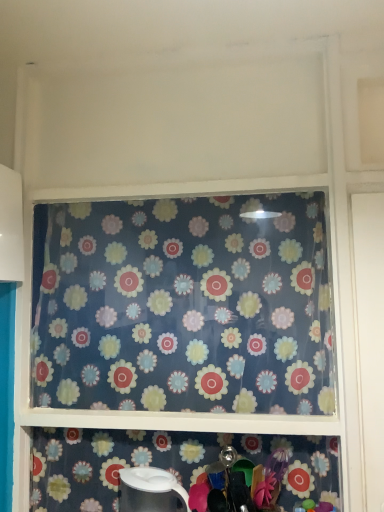
Question: From a real-world perspective, is white glossy kettle at lower center physically above floral-patterned fabric at center?

Choices:
 (A) yes
 (B) no

Answer: (B)

Question: Is white glossy kettle at lower center directly adjacent to floral-patterned fabric at center?

Choices:
 (A) no
 (B) yes

Answer: (A)

Question: Does white glossy kettle at lower center have a smaller size compared to floral-patterned fabric at center?

Choices:
 (A) no
 (B) yes

Answer: (B)

Question: Would you say white glossy kettle at lower center is a long distance from floral-patterned fabric at center?

Choices:
 (A) no
 (B) yes

Answer: (A)

Question: Can you confirm if white glossy kettle at lower center is shorter than floral-patterned fabric at center?

Choices:
 (A) no
 (B) yes

Answer: (B)

Question: From a real-world perspective, is white glossy pitcher at lower center positioned above or below floral-patterned fabric at center?

Choices:
 (A) below
 (B) above

Answer: (A)

Question: Is white glossy pitcher at lower center wider or thinner than floral-patterned fabric at center?

Choices:
 (A) thin
 (B) wide

Answer: (A)

Question: Is point (203, 480) closer or farther from the camera than point (210, 257)?

Choices:
 (A) closer
 (B) farther

Answer: (A)

Question: Is white glossy pitcher at lower center situated inside floral-patterned fabric at center or outside?

Choices:
 (A) outside
 (B) inside

Answer: (A)

Question: Looking at the image, does white glossy kettle at lower center seem bigger or smaller compared to white glossy pitcher at lower center?

Choices:
 (A) small
 (B) big

Answer: (A)

Question: Considering the positions of white glossy kettle at lower center and white glossy pitcher at lower center in the image, is white glossy kettle at lower center wider or thinner than white glossy pitcher at lower center?

Choices:
 (A) thin
 (B) wide

Answer: (B)

Question: Is point (125, 507) closer or farther from the camera than point (92, 501)?

Choices:
 (A) closer
 (B) farther

Answer: (A)

Question: From the image's perspective, relative to white glossy pitcher at lower center, is white glossy kettle at lower center above or below?

Choices:
 (A) above
 (B) below

Answer: (B)

Question: Considering their positions, is white glossy pitcher at lower center located in front of or behind white glossy kettle at lower center?

Choices:
 (A) front
 (B) behind

Answer: (B)

Question: Is white glossy pitcher at lower center inside the boundaries of white glossy kettle at lower center, or outside?

Choices:
 (A) inside
 (B) outside

Answer: (B)